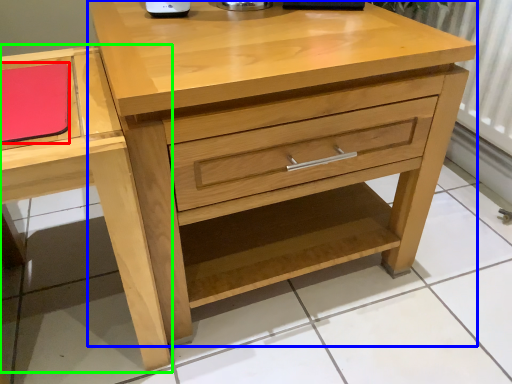
Question: Which object is the farthest from notepad (highlighted by a red box)? Choose among these: chest of drawers (highlighted by a blue box) or vanity (highlighted by a green box).

Choices:
 (A) chest of drawers
 (B) vanity

Answer: (A)